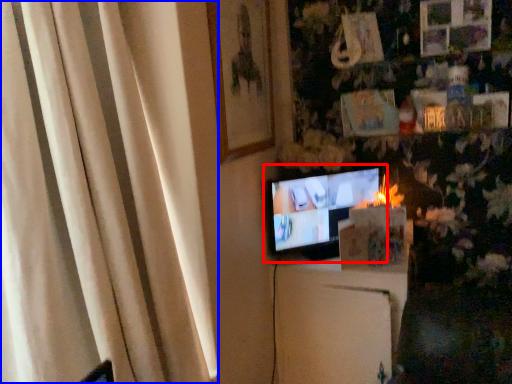
Question: Which point is closer to the camera, television (highlighted by a red box) or curtain (highlighted by a blue box)?

Choices:
 (A) television
 (B) curtain

Answer: (B)